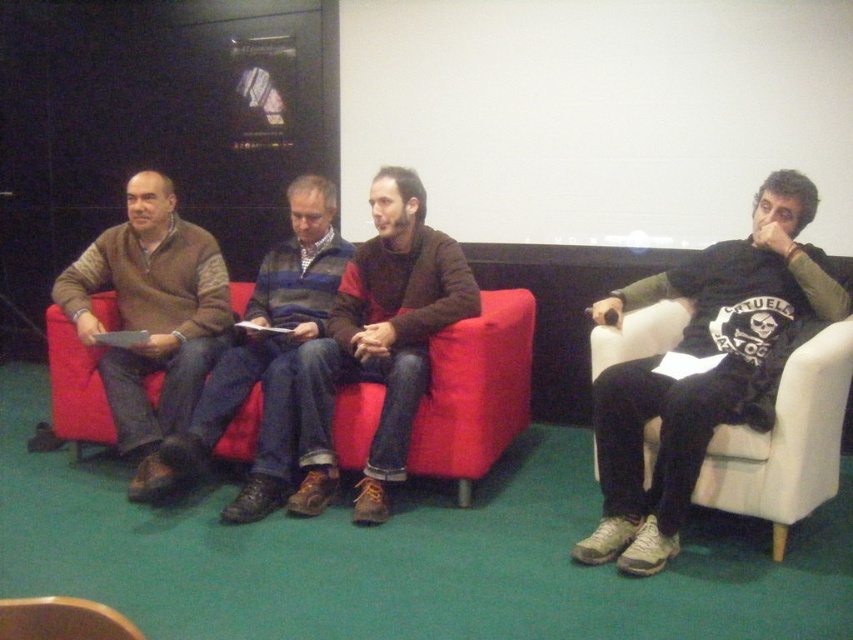
Where is the red fabric couch at center located in the image?

The red fabric couch at center is located at point 0.613 on the x axis and 0.558 on the y axis.

You are organizing a small event and need to seat two guests. You have a brown leather jacket at center and a brown leather armchair at lower left. Which item can accommodate a larger guest comfortably?

The brown leather jacket at center has a larger size compared to the brown leather armchair at lower left, so it can accommodate a larger guest more comfortably.

You are an interior designer planning to place a new lamp on the wall behind the red fabric couch at center. According to the scene, where should you place the lamp relative to the brown sweater at left?

The red fabric couch at center is positioned under the brown sweater at left, so the lamp should be placed above the red fabric couch at center to align with the position of the brown sweater at left.